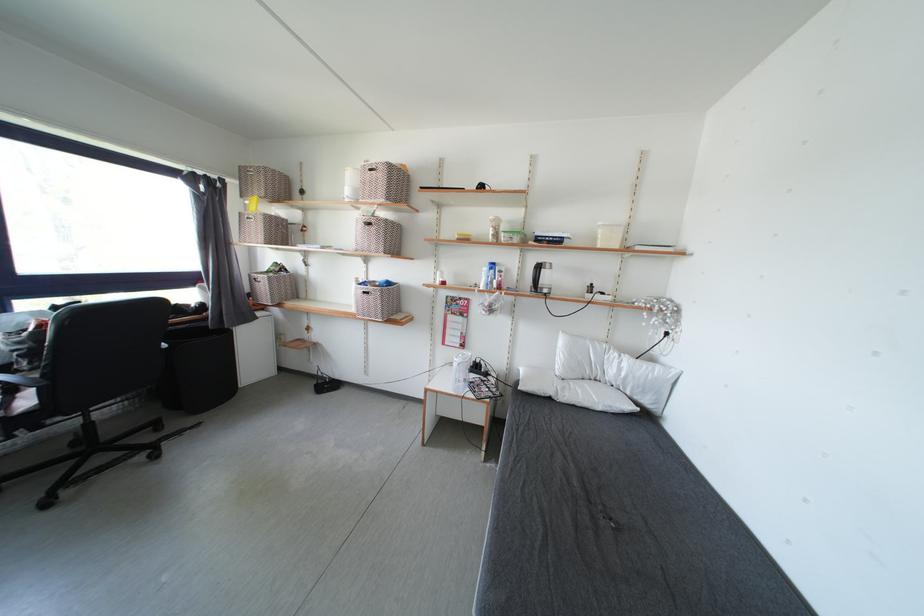
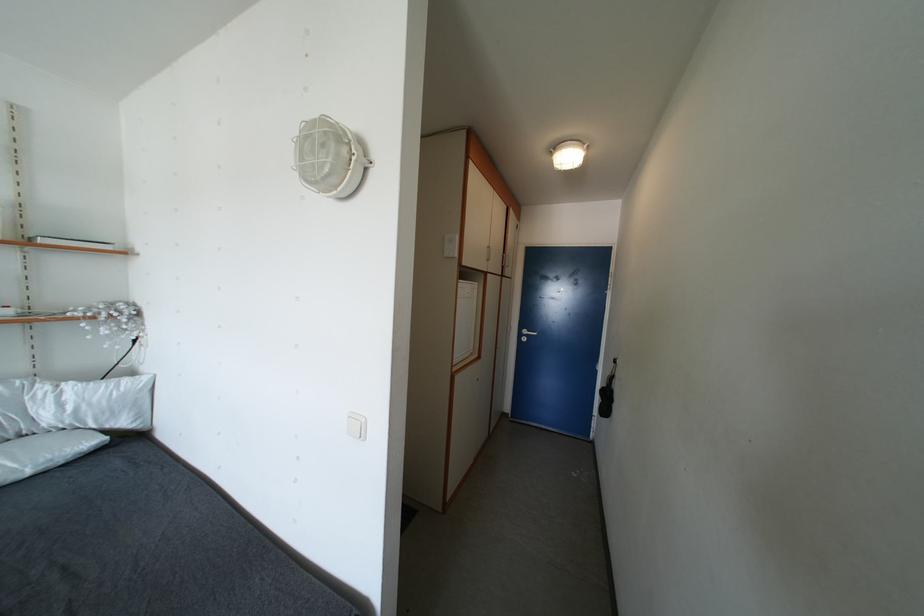
Question: The camera is either moving clockwise (left) or counter-clockwise (right) around the object. The first image is from the beginning of the video and the second image is from the end. Is the camera moving left or right when shooting the video?

Choices:
 (A) Left
 (B) Right

Answer: (A)